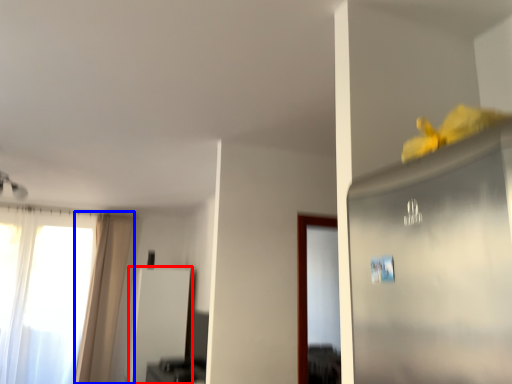
Question: Which point is further to the camera, screen door (highlighted by a red box) or curtain (highlighted by a blue box)?

Choices:
 (A) screen door
 (B) curtain

Answer: (B)